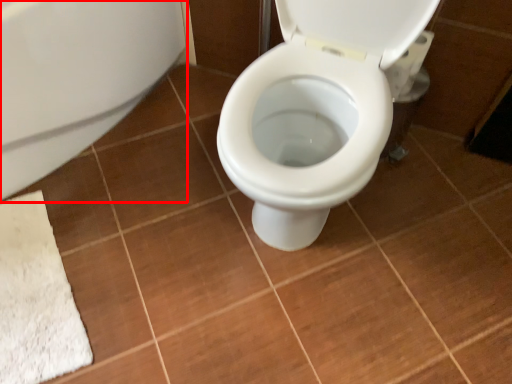
Question: From the image's perspective, where is bath (annotated by the red box) located in relation to toilet paper in the image?

Choices:
 (A) below
 (B) above

Answer: (A)